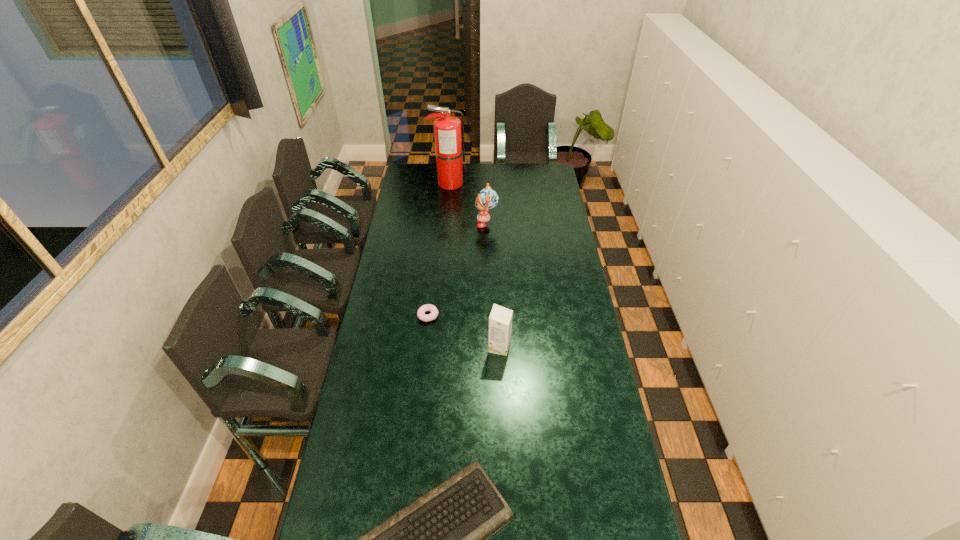
You are a GUI agent. You are given a task and a screenshot of the screen. Output one action in this format:
    pyautogui.click(x=<x>, y=<y>)
    Task: Click on the free space located 0.150m on the right of the second nearest object
    The image size is (960, 540).
    Given the screenshot: What is the action you would take?
    pyautogui.click(x=549, y=347)

Locate an element on the screen. The height and width of the screenshot is (540, 960). vacant space positioned 0.400m on the back of the third nearest object is located at coordinates (436, 248).

You are a GUI agent. You are given a task and a screenshot of the screen. Output one action in this format:
    pyautogui.click(x=<x>, y=<y>)
    Task: Click on the object at the far edge
    The image size is (960, 540).
    Given the screenshot: What is the action you would take?
    pyautogui.click(x=449, y=142)

Where is `vacant space at the far edge of the desktop`? vacant space at the far edge of the desktop is located at coordinates (517, 184).

I want to click on vacant space at the left edge, so click(394, 287).

Where is `vacant space at the far right corner of the desktop`? vacant space at the far right corner of the desktop is located at coordinates (533, 170).

Identify the location of free point between the fire extinguisher and the third farthest object. Image resolution: width=960 pixels, height=540 pixels. (439, 249).

This screenshot has height=540, width=960. Identify the location of vacant point located between the shortest object and the fourth farthest object. (464, 331).

The width and height of the screenshot is (960, 540). Identify the location of vacant area that lies between the fourth nearest object and the fire extinguisher. (468, 204).

This screenshot has height=540, width=960. I want to click on free spot between the doll and the fire extinguisher, so click(468, 204).